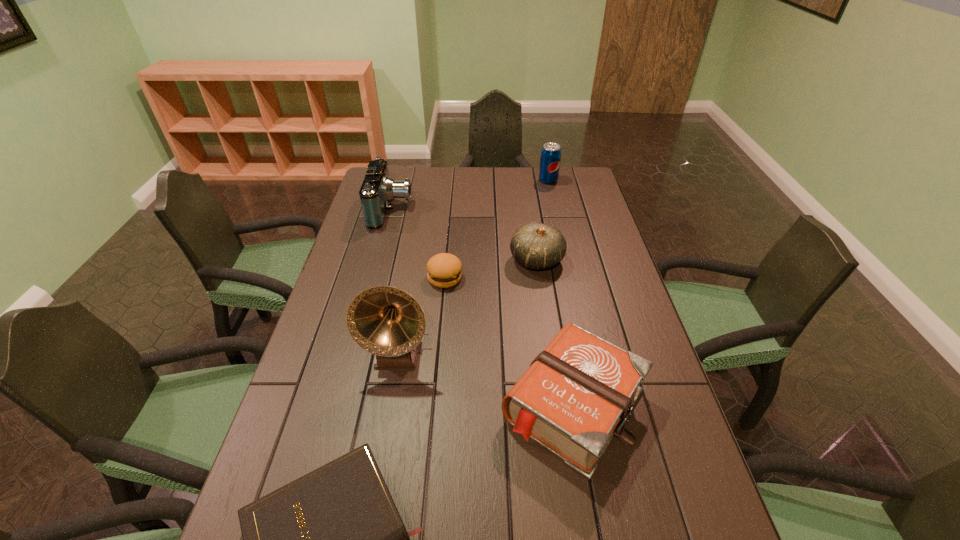
In the image, there is a desktop. Where is `vacant space at the far edge`? This screenshot has width=960, height=540. vacant space at the far edge is located at coordinates (537, 177).

The width and height of the screenshot is (960, 540). In the image, there is a desktop. Find the location of `vacant area at the left edge`. vacant area at the left edge is located at coordinates (351, 245).

Image resolution: width=960 pixels, height=540 pixels. In the image, there is a desktop. Find the location of `vacant space at the far right corner`. vacant space at the far right corner is located at coordinates (572, 179).

The width and height of the screenshot is (960, 540). In order to click on free space between the farthest object and the sixth nearest object in this screenshot , I will do pos(469,195).

This screenshot has height=540, width=960. Find the location of `free space between the gourd and the farthest object`. free space between the gourd and the farthest object is located at coordinates (542, 220).

Locate an element on the screen. This screenshot has width=960, height=540. vacant point located between the hamburger and the camcorder is located at coordinates (419, 244).

Locate an element on the screen. unoccupied position between the taller Bible and the tallest object is located at coordinates (486, 379).

This screenshot has width=960, height=540. In order to click on free space that is in between the hamburger and the gourd in this screenshot , I will do `click(491, 269)`.

You are a GUI agent. You are given a task and a screenshot of the screen. Output one action in this format:
    pyautogui.click(x=<x>, y=<y>)
    Task: Click on the unoccupied area between the camcorder and the farthest object
    
    Given the screenshot: What is the action you would take?
    pyautogui.click(x=469, y=195)

Find the location of a particular element. The width and height of the screenshot is (960, 540). object that ranks as the second closest to the tallest object is located at coordinates (576, 395).